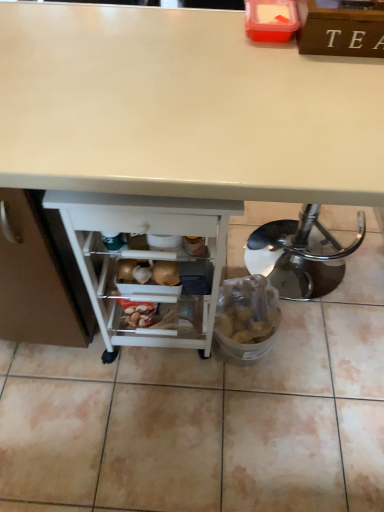
This screenshot has height=512, width=384. I want to click on white plastic shelf at lower center, so click(x=148, y=262).

What is the approximate height of white plastic shelf at lower center?

29.54 inches.

What do you see at coordinates (148, 262) in the screenshot?
I see `white plastic shelf at lower center` at bounding box center [148, 262].

The width and height of the screenshot is (384, 512). Describe the element at coordinates (182, 109) in the screenshot. I see `white glossy desk at center` at that location.

The width and height of the screenshot is (384, 512). In order to click on white glossy desk at center in this screenshot , I will do `click(182, 109)`.

Locate an element on the screen. This screenshot has width=384, height=512. white plastic shelf at lower center is located at coordinates (148, 262).

In the image, is white glossy desk at center on the left side or the right side of white plastic shelf at lower center?

Based on their positions, white glossy desk at center is located to the right of white plastic shelf at lower center.

Is white glossy desk at center behind white plastic shelf at lower center?

No, white glossy desk at center is in front of white plastic shelf at lower center.

Which is in front, point (121, 32) or point (156, 223)?

Point (156, 223)

From the image's perspective, is white glossy desk at center beneath white plastic shelf at lower center?

No.

From a real-world perspective, does white glossy desk at center stand above white plastic shelf at lower center?

Yes.

Which object is thinner, white glossy desk at center or white plastic shelf at lower center?

With smaller width is white plastic shelf at lower center.

Which of these two, white glossy desk at center or white plastic shelf at lower center, stands taller?

Standing taller between the two is white glossy desk at center.

Considering the sizes of white glossy desk at center and white plastic shelf at lower center in the image, is white glossy desk at center bigger or smaller than white plastic shelf at lower center?

white glossy desk at center is bigger than white plastic shelf at lower center.

Is white glossy desk at center surrounding white plastic shelf at lower center?

Yes, white plastic shelf at lower center is surrounded by white glossy desk at center.

Is white glossy desk at center next to white plastic shelf at lower center?

There is a gap between white glossy desk at center and white plastic shelf at lower center.

Is white glossy desk at center facing away from white plastic shelf at lower center?

Yes.

The image size is (384, 512). I want to click on shelf located behind the white glossy desk at center, so click(x=148, y=262).

Can you confirm if white plastic shelf at lower center is positioned to the left of white glossy desk at center?

Yes, white plastic shelf at lower center is to the left of white glossy desk at center.

Is white plastic shelf at lower center positioned behind white glossy desk at center?

Yes, white plastic shelf at lower center is further from the camera.

Which is closer to the camera, (79, 216) or (208, 87)?

The point (79, 216) is in front.

From the image's perspective, which one is positioned higher, white plastic shelf at lower center or white glossy desk at center?

white glossy desk at center appears higher in the image.

Consider the image. From a real-world perspective, between white plastic shelf at lower center and white glossy desk at center, who is vertically lower?

In real-world perspective, white plastic shelf at lower center is lower.

Is white plastic shelf at lower center wider than white glossy desk at center?

In fact, white plastic shelf at lower center might be narrower than white glossy desk at center.

Can you confirm if white plastic shelf at lower center is taller than white glossy desk at center?

No.

Is white plastic shelf at lower center bigger or smaller than white glossy desk at center?

Considering their sizes, white plastic shelf at lower center takes up less space than white glossy desk at center.

Would you say white glossy desk at center is part of white plastic shelf at lower center's contents?

No, white glossy desk at center is not inside white plastic shelf at lower center.

Is white plastic shelf at lower center directly adjacent to white glossy desk at center?

No.

In the scene shown: Is white plastic shelf at lower center oriented towards white glossy desk at center?

Yes, white plastic shelf at lower center faces towards white glossy desk at center.

Can you tell me how much white plastic shelf at lower center and white glossy desk at center differ in facing direction?

They differ by 93.3 degrees in their facing directions.

Measure the distance between white plastic shelf at lower center and white glossy desk at center.

white plastic shelf at lower center and white glossy desk at center are 9.20 inches apart from each other.

At what (x,y) coordinates should I click in order to perform the action: click on desk lying above the white plastic shelf at lower center (from the image's perspective). Please return your answer as a coordinate pair (x, y). Looking at the image, I should click on (182, 109).

Locate an element on the screen. The height and width of the screenshot is (512, 384). desk that appears on the right of white plastic shelf at lower center is located at coordinates (182, 109).

The height and width of the screenshot is (512, 384). Find the location of `shelf that appears on the left of white glossy desk at center`. shelf that appears on the left of white glossy desk at center is located at coordinates (148, 262).